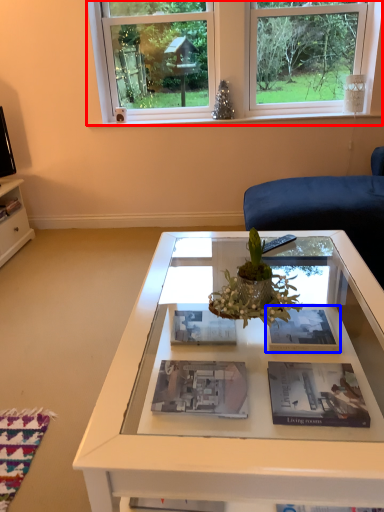
Question: Which object appears farthest to the camera in this image, window (highlighted by a red box) or magazine (highlighted by a blue box)?

Choices:
 (A) window
 (B) magazine

Answer: (A)